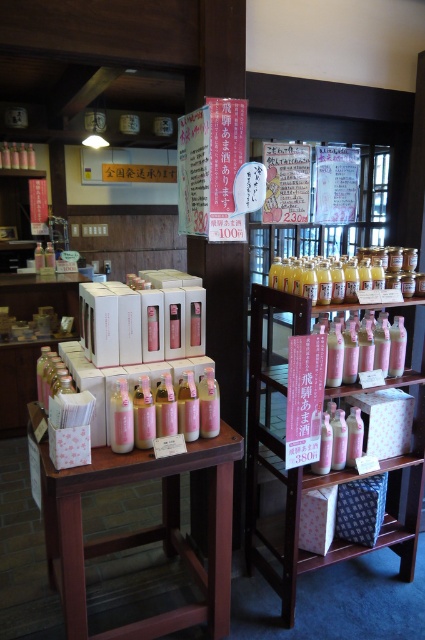
Between wooden table at center and pink matte bottles at center right, which one is positioned lower?

wooden table at center is lower down.

Does wooden table at center have a greater height compared to pink matte bottles at center right?

Incorrect, wooden table at center's height is not larger of pink matte bottles at center right's.

The width and height of the screenshot is (425, 640). What do you see at coordinates (142, 531) in the screenshot? I see `wooden table at center` at bounding box center [142, 531].

Locate an element on the screen. wooden table at center is located at coordinates (142, 531).